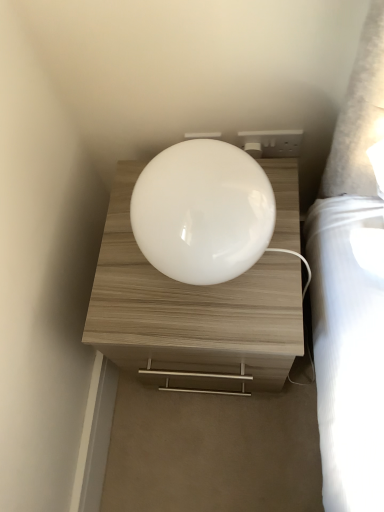
The height and width of the screenshot is (512, 384). Identify the location of free space above white glossy nightstand at center (from a real-world perspective). (188, 290).